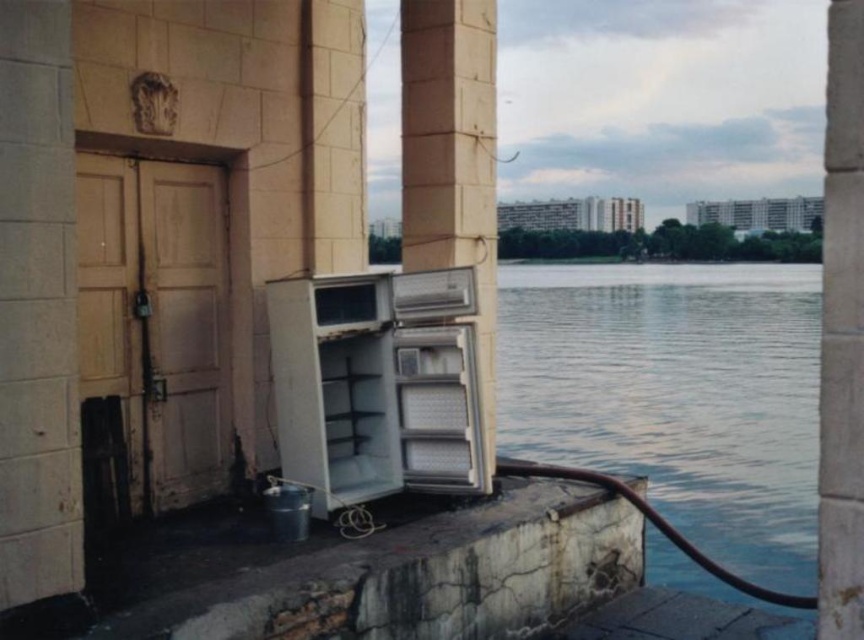
Question: Among these objects, which one is farthest from the camera?

Choices:
 (A) smooth concrete pillar at right
 (B) white plastic refrigerator at center

Answer: (B)

Question: Estimate the real-world distances between objects in this image. Which object is closer to the smooth concrete pillar at right?

Choices:
 (A) white plastic refrigerator at lower left
 (B) white plastic refrigerator at center

Answer: (B)

Question: Can you confirm if white plastic refrigerator at center is wider than smooth concrete pillar at right?

Choices:
 (A) no
 (B) yes

Answer: (A)

Question: Does white plastic refrigerator at lower left have a greater width compared to white plastic refrigerator at center?

Choices:
 (A) yes
 (B) no

Answer: (A)

Question: Which point is closer to the camera?

Choices:
 (A) smooth concrete pillar at right
 (B) white plastic refrigerator at lower left
 (C) white plastic refrigerator at center

Answer: (A)

Question: Can you confirm if white plastic refrigerator at center is bigger than smooth concrete pillar at right?

Choices:
 (A) yes
 (B) no

Answer: (B)